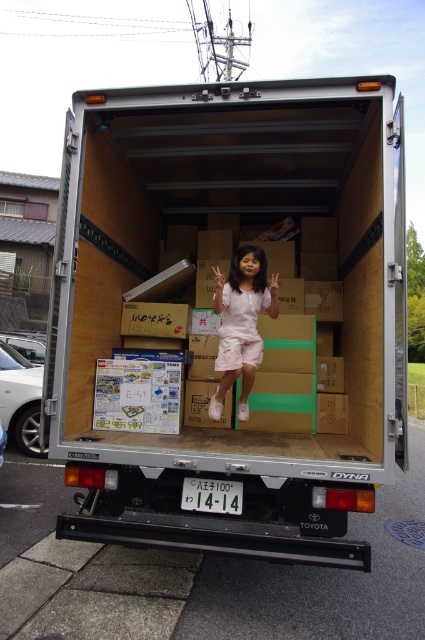
Can you confirm if silver metallic truck at center is taller than white plastic license plate at center?

Yes.

Who is higher up, silver metallic truck at center or white plastic license plate at center?

Positioned higher is silver metallic truck at center.

Is point (311, 552) positioned after point (226, 508)?

No, (311, 552) is closer to viewer.

I want to click on silver metallic truck at center, so click(x=189, y=282).

Can you confirm if white matte shorts at center is wider than white plastic license plate at center?

Yes.

Is point (243, 292) closer to viewer compared to point (229, 481)?

No, it is behind (229, 481).

Is point (254, 330) farther from camera compared to point (212, 497)?

Yes, point (254, 330) is behind point (212, 497).

Locate an element on the screen. white matte shorts at center is located at coordinates pyautogui.click(x=240, y=323).

Which is behind, point (90, 410) or point (221, 352)?

The point (221, 352) is more distant.

Does silver metallic truck at center appear on the right side of white matte shorts at center?

Incorrect, silver metallic truck at center is not on the right side of white matte shorts at center.

Describe the element at coordinates (189, 282) in the screenshot. This screenshot has height=640, width=425. I see `silver metallic truck at center` at that location.

At what (x,y) coordinates should I click in order to perform the action: click on silver metallic truck at center. Please return your answer as a coordinate pair (x, y). The image size is (425, 640). Looking at the image, I should click on (189, 282).